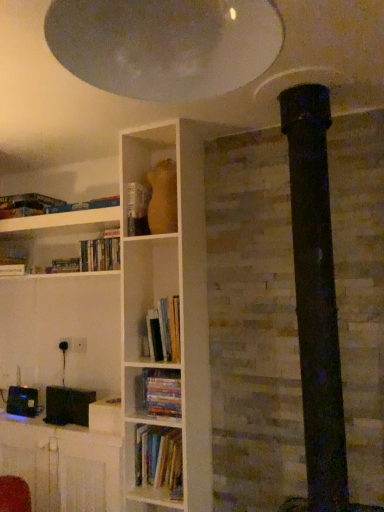
Question: From the image's perspective, relative to white glossy exhaust hood at upper center, is black plastic table at lower left above or below?

Choices:
 (A) above
 (B) below

Answer: (B)

Question: Considering the positions of black plastic table at lower left and white glossy exhaust hood at upper center in the image, is black plastic table at lower left bigger or smaller than white glossy exhaust hood at upper center?

Choices:
 (A) small
 (B) big

Answer: (B)

Question: Based on their relative distances, which object is farther from the white glossy exhaust hood at upper center?

Choices:
 (A) hardcover book at center
 (B) hardcover books at center, the 3th book viewed from the top
 (C) hardcover books at center, the 2th book from the top
 (D) hardcover books at center, positioned as the 3th book in bottom-to-top order
 (E) black plastic table at lower left

Answer: (E)

Question: Considering the real-world distances, which object is farthest from the hardcover books at center, which is the first book from top to bottom?

Choices:
 (A) hardcover books at center, positioned as the 2th book in bottom-to-top order
 (B) white glossy exhaust hood at upper center
 (C) black plastic table at lower left
 (D) hardcover books at center, arranged as the first book when ordered from the bottom
 (E) hardcover book at center

Answer: (B)